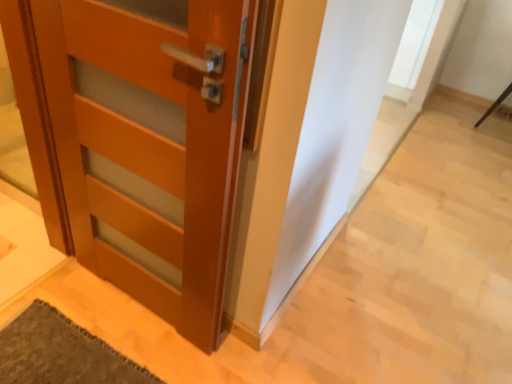
What do you see at coordinates (150, 142) in the screenshot? The width and height of the screenshot is (512, 384). I see `matte wood door at left` at bounding box center [150, 142].

Measure the distance between point (x=168, y=142) and camera.

1.17 meters.

Image resolution: width=512 pixels, height=384 pixels. I want to click on matte wood door at left, so click(150, 142).

Identify the location of matte wood door at left. The height and width of the screenshot is (384, 512). (150, 142).